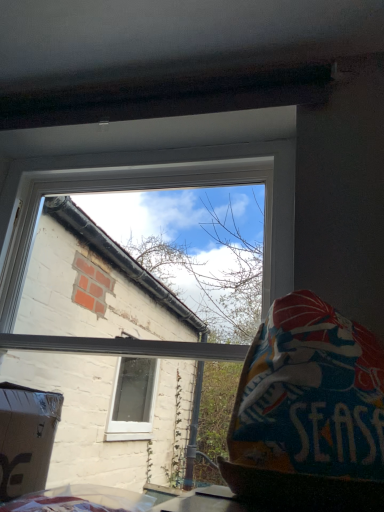
Question: Would you say textured fabric bean bag at right is inside or outside white plastic window at upper center?

Choices:
 (A) outside
 (B) inside

Answer: (A)

Question: From the image's perspective, relative to white plastic window at upper center, is textured fabric bean bag at right above or below?

Choices:
 (A) below
 (B) above

Answer: (A)

Question: In the image, is textured fabric bean bag at right on the left side or the right side of white plastic window at upper center?

Choices:
 (A) right
 (B) left

Answer: (A)

Question: Is white plastic window at upper center inside the boundaries of textured fabric bean bag at right, or outside?

Choices:
 (A) inside
 (B) outside

Answer: (B)

Question: Looking at their shapes, would you say white plastic window at upper center is wider or thinner than textured fabric bean bag at right?

Choices:
 (A) wide
 (B) thin

Answer: (B)

Question: From a real-world perspective, is white plastic window at upper center physically located above or below textured fabric bean bag at right?

Choices:
 (A) below
 (B) above

Answer: (B)

Question: In terms of height, does white plastic window at upper center look taller or shorter compared to textured fabric bean bag at right?

Choices:
 (A) tall
 (B) short

Answer: (A)